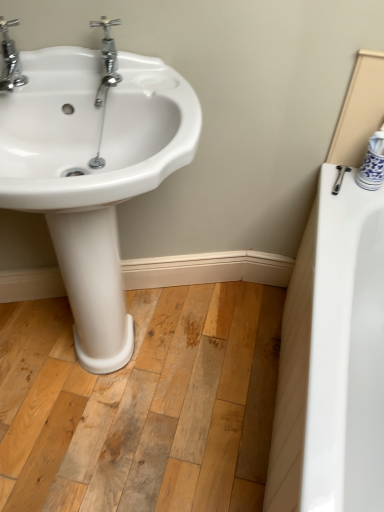
Question: From a real-world perspective, is white glossy sink at left positioned above or below chrome/metallic faucet at upper left, arranged as the first tap when viewed from the right?

Choices:
 (A) above
 (B) below

Answer: (B)

Question: From the image's perspective, is white glossy sink at left above or below chrome/metallic faucet at upper left, the 2th tap in the left-to-right sequence?

Choices:
 (A) above
 (B) below

Answer: (B)

Question: Which is farther from the chrome/metallic faucet at upper left, arranged as the first tap when viewed from the right?

Choices:
 (A) chrome metallic faucet at upper left, the 1th tap from the left
 (B) white glossy sink at left

Answer: (B)

Question: Which is farther from the white glossy sink at left?

Choices:
 (A) chrome/metallic faucet at upper left, arranged as the first tap when viewed from the right
 (B) chrome metallic faucet at upper left, the 1th tap from the left

Answer: (B)